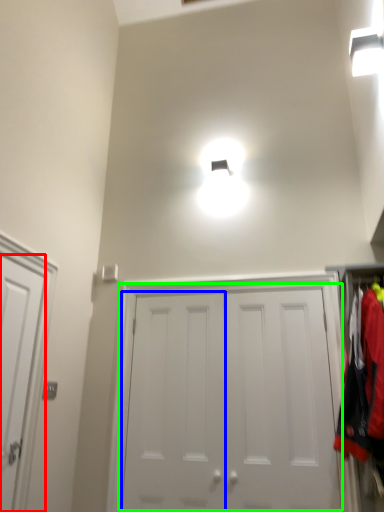
Question: Which object is the closest to the door (highlighted by a red box)? Choose among these: door (highlighted by a blue box) or door (highlighted by a green box).

Choices:
 (A) door
 (B) door

Answer: (A)